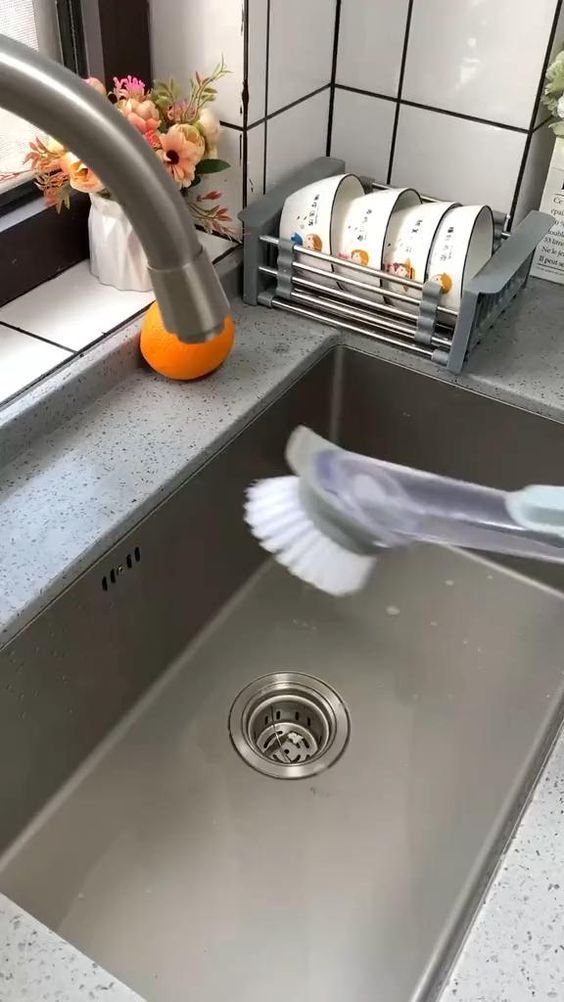
Identify the location of bowl. This screenshot has height=1002, width=564. (319, 228), (351, 229), (407, 239), (452, 246).